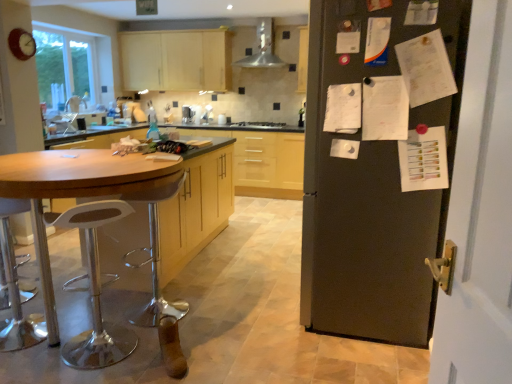
At what (x,y) coordinates should I click in order to perform the action: click on vacant area that lies between matte black refrigerator at right and white plastic bar stool at left, the second bar stool in the back-to-front sequence. Please return your answer as a coordinate pair (x, y). Looking at the image, I should click on (257, 328).